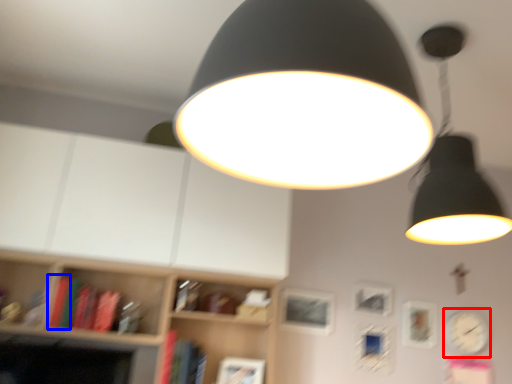
Question: Which point is further to the camera, clock (highlighted by a red box) or book (highlighted by a blue box)?

Choices:
 (A) clock
 (B) book

Answer: (A)